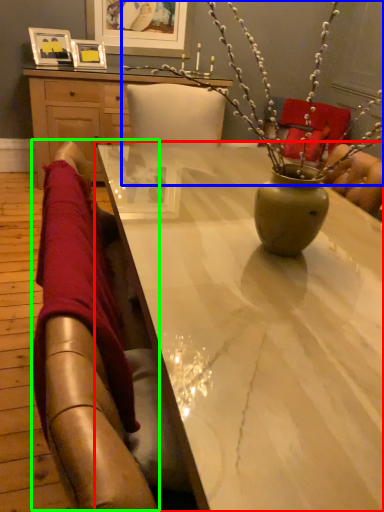
Question: Considering the real-world distances, which object is farthest from table (highlighted by a red box)? floral arrangement (highlighted by a blue box) or selfie (highlighted by a green box)?

Choices:
 (A) floral arrangement
 (B) selfie

Answer: (B)